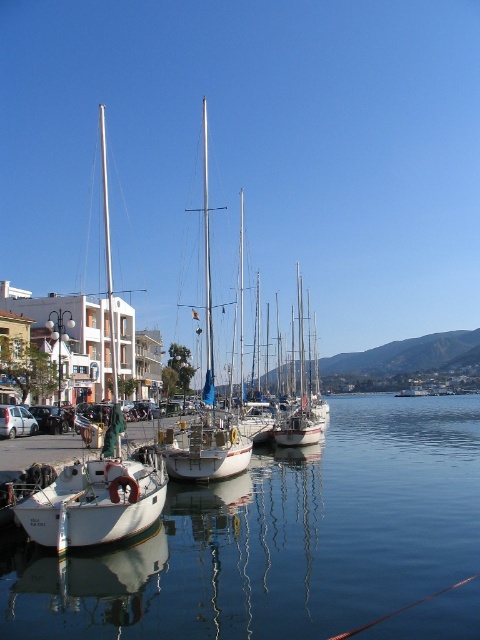
Question: Which point is closer to the camera?

Choices:
 (A) white matte sailboat at left
 (B) white matte sailboat at center
 (C) clear glass water at lower left

Answer: (C)

Question: From the image, what is the correct spatial relationship of white matte sailboat at left in relation to white matte sailboat at center?

Choices:
 (A) left
 (B) right

Answer: (A)

Question: Which point is closer to the camera?

Choices:
 (A) clear glass water at lower left
 (B) white matte sailboat at center

Answer: (A)

Question: Is clear glass water at lower left to the right of white matte sailboat at center from the viewer's perspective?

Choices:
 (A) yes
 (B) no

Answer: (A)

Question: Among these points, which one is farthest from the camera?

Choices:
 (A) (113, 397)
 (B) (118, 564)

Answer: (A)

Question: Does clear glass water at lower left appear on the left side of white matte sailboat at left?

Choices:
 (A) yes
 (B) no

Answer: (B)